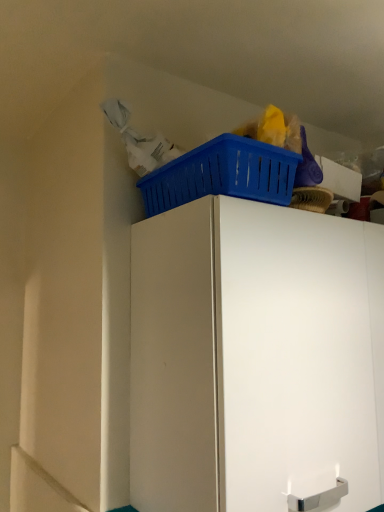
Measure the distance between white matte cabinet at upper center and camera.

white matte cabinet at upper center and camera are 25.19 inches apart.

Find the location of a particular element. white matte cabinet at upper center is located at coordinates (252, 356).

The height and width of the screenshot is (512, 384). Describe the element at coordinates (252, 356) in the screenshot. I see `white matte cabinet at upper center` at that location.

In order to face white matte cabinet at upper center, should I rotate leftwards or rightwards?

It's best to rotate right around 16.364 degrees.

Image resolution: width=384 pixels, height=512 pixels. I want to click on blue plastic basket at upper right, so [x=222, y=174].

This screenshot has width=384, height=512. Describe the element at coordinates (222, 174) in the screenshot. I see `blue plastic basket at upper right` at that location.

Where is `white matte cabinet at upper center`? This screenshot has height=512, width=384. white matte cabinet at upper center is located at coordinates (252, 356).

Is white matte cabinet at upper center at the right side of blue plastic basket at upper right?

Indeed, white matte cabinet at upper center is positioned on the right side of blue plastic basket at upper right.

Between white matte cabinet at upper center and blue plastic basket at upper right, which one is positioned behind?

blue plastic basket at upper right is more distant.

Does point (189, 263) come behind point (267, 154)?

No, it is not.

From the image's perspective, is white matte cabinet at upper center located above or below blue plastic basket at upper right?

white matte cabinet at upper center is below blue plastic basket at upper right.

From a real-world perspective, who is located higher, white matte cabinet at upper center or blue plastic basket at upper right?

From a 3D spatial view, blue plastic basket at upper right is above.

Which object is wider, white matte cabinet at upper center or blue plastic basket at upper right?

white matte cabinet at upper center is wider.

From their relative heights in the image, would you say white matte cabinet at upper center is taller or shorter than blue plastic basket at upper right?

white matte cabinet at upper center is taller than blue plastic basket at upper right.

Is white matte cabinet at upper center bigger or smaller than blue plastic basket at upper right?

Clearly, white matte cabinet at upper center is larger in size than blue plastic basket at upper right.

Is blue plastic basket at upper right completely or partially inside white matte cabinet at upper center?

Actually, blue plastic basket at upper right is outside white matte cabinet at upper center.

Are white matte cabinet at upper center and blue plastic basket at upper right located far from each other?

Actually, white matte cabinet at upper center and blue plastic basket at upper right are a little close together.

Could you tell me if white matte cabinet at upper center is facing blue plastic basket at upper right?

No, white matte cabinet at upper center is not facing towards blue plastic basket at upper right.

How different are the orientations of white matte cabinet at upper center and blue plastic basket at upper right in degrees?

The facing directions of white matte cabinet at upper center and blue plastic basket at upper right are 1.8 degrees apart.

Identify the location of cabinetry located on the right of blue plastic basket at upper right. The image size is (384, 512). [x=252, y=356].

Does blue plastic basket at upper right appear on the right side of white matte cabinet at upper center?

Incorrect, blue plastic basket at upper right is not on the right side of white matte cabinet at upper center.

Is blue plastic basket at upper right in front of white matte cabinet at upper center?

No, blue plastic basket at upper right is further to the viewer.

Which is behind, point (293, 154) or point (241, 209)?

The point (293, 154) is behind.

From the image's perspective, is blue plastic basket at upper right located beneath white matte cabinet at upper center?

Incorrect, from the image's perspective, blue plastic basket at upper right is higher than white matte cabinet at upper center.

From a real-world perspective, who is located lower, blue plastic basket at upper right or white matte cabinet at upper center?

white matte cabinet at upper center is physically lower.

Which object is thinner, blue plastic basket at upper right or white matte cabinet at upper center?

blue plastic basket at upper right.

Looking at this image, from their relative heights in the image, would you say blue plastic basket at upper right is taller or shorter than white matte cabinet at upper center?

In the image, blue plastic basket at upper right appears to be shorter than white matte cabinet at upper center.

Looking at this image, who is smaller, blue plastic basket at upper right or white matte cabinet at upper center?

blue plastic basket at upper right is smaller.

Would you say white matte cabinet at upper center is part of blue plastic basket at upper right's contents?

No, white matte cabinet at upper center is not surrounded by blue plastic basket at upper right.

Is blue plastic basket at upper right with white matte cabinet at upper center?

No, blue plastic basket at upper right is not in contact with white matte cabinet at upper center.

Could you tell me if blue plastic basket at upper right is turned towards white matte cabinet at upper center?

No, blue plastic basket at upper right is not aimed at white matte cabinet at upper center.

How many degrees apart are the facing directions of blue plastic basket at upper right and white matte cabinet at upper center?

They differ by 1.8 degrees in their facing directions.

Image resolution: width=384 pixels, height=512 pixels. In order to click on cabinetry below the blue plastic basket at upper right (from a real-world perspective) in this screenshot , I will do `click(252, 356)`.

You are a GUI agent. You are given a task and a screenshot of the screen. Output one action in this format:
    pyautogui.click(x=<x>, y=<y>)
    Task: Click on the basket behind the white matte cabinet at upper center
    
    Given the screenshot: What is the action you would take?
    pyautogui.click(x=222, y=174)

Where is `basket on the left side of white matte cabinet at upper center`? basket on the left side of white matte cabinet at upper center is located at coordinates (222, 174).